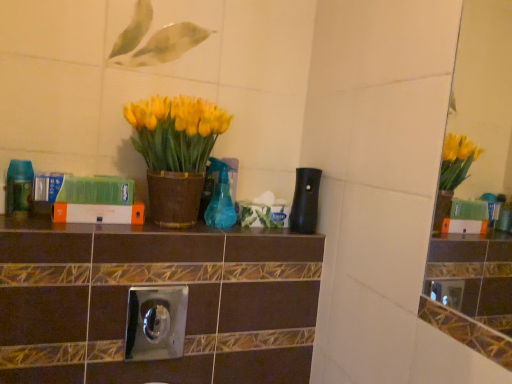
Question: From their relative heights in the image, would you say translucent green bottle at left, which appears as the 3th bottle when viewed from the right, is taller or shorter than matte brown pot at center?

Choices:
 (A) tall
 (B) short

Answer: (B)

Question: From a real-world perspective, relative to matte brown pot at center, is translucent green bottle at left, which appears as the 3th bottle when viewed from the right, vertically above or below?

Choices:
 (A) below
 (B) above

Answer: (A)

Question: Estimate the real-world distances between objects in this image. Which object is closer to the translucent blue spray bottle at center, the 2th bottle viewed from the right?

Choices:
 (A) translucent green bottle at left, which appears as the 3th bottle when viewed from the right
 (B) black matte bottle at center, the 1th bottle viewed from the right
 (C) matte brown pot at center

Answer: (C)

Question: Which object is positioned farthest from the black matte bottle at center, the 1th bottle viewed from the right?

Choices:
 (A) translucent blue spray bottle at center, which is the second bottle in left-to-right order
 (B) matte brown pot at center
 (C) translucent green bottle at left, which appears as the 3th bottle when viewed from the right

Answer: (C)